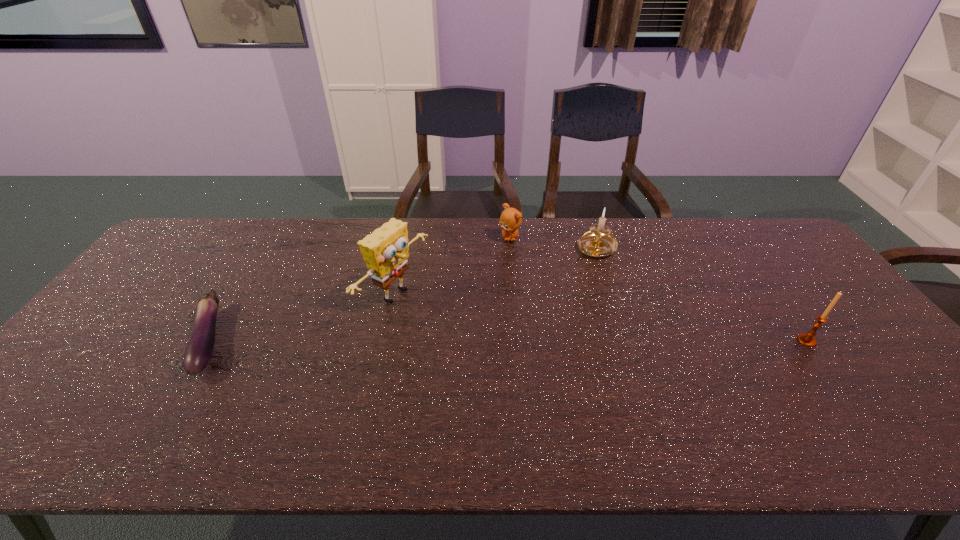
Identify the location of vacant space located on the back of the leftmost object. (242, 285).

Where is `free space located 0.260m on the back of the rightmost object`? This screenshot has width=960, height=540. free space located 0.260m on the back of the rightmost object is located at coordinates (756, 271).

At what (x,y) coordinates should I click in order to perform the action: click on free space located on the face of the second shortest object. Please return your answer as a coordinate pair (x, y). Looking at the image, I should click on (511, 298).

Locate an element on the screen. free space located 0.140m on the face of the second shortest object is located at coordinates (511, 271).

The width and height of the screenshot is (960, 540). I want to click on blank space located on the face of the second shortest object, so click(x=512, y=331).

Where is `free location located on the face of the tallest object`? The image size is (960, 540). free location located on the face of the tallest object is located at coordinates (545, 376).

Find the location of a particular element. This screenshot has width=960, height=540. free space located 0.110m on the face of the tallest object is located at coordinates (452, 329).

At what (x,y) coordinates should I click in order to perform the action: click on free space located 0.050m on the face of the tallest object. Please return your answer as a coordinate pair (x, y). Image resolution: width=960 pixels, height=540 pixels. Looking at the image, I should click on (434, 320).

The image size is (960, 540). I want to click on vacant space situated 0.070m on the handle side of the second object from right to left, so click(578, 271).

What are the coordinates of `blank space located on the handle side of the second object from right to left` in the screenshot? It's located at (570, 279).